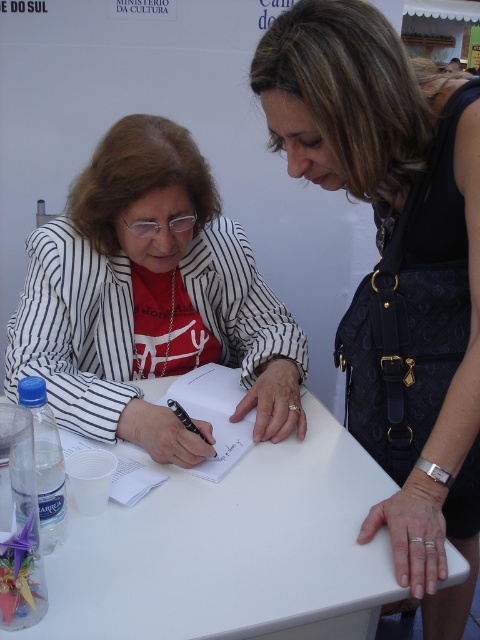
Is matte black jacket at center further to camera compared to white plastic table at center?

Yes, matte black jacket at center is behind white plastic table at center.

Does matte black jacket at center appear on the left side of white plastic table at center?

Indeed, matte black jacket at center is positioned on the left side of white plastic table at center.

Is point (112, 403) closer to camera compared to point (384, 556)?

That is False.

Locate an element on the screen. The height and width of the screenshot is (640, 480). matte black jacket at center is located at coordinates (149, 300).

Measure the distance between black leather handbag at upper right and camera.

The distance of black leather handbag at upper right from camera is 29.82 inches.

Between black leather handbag at upper right and matte black jacket at center, which one is positioned lower?

black leather handbag at upper right is below.

What do you see at coordinates (396, 268) in the screenshot?
I see `black leather handbag at upper right` at bounding box center [396, 268].

Locate an element on the screen. This screenshot has width=480, height=640. black leather handbag at upper right is located at coordinates (396, 268).

Does black leather handbag at upper right have a lesser height compared to white plastic table at center?

No.

Can you confirm if black leather handbag at upper right is positioned below white plastic table at center?

No, black leather handbag at upper right is not below white plastic table at center.

Identify the location of black leather handbag at upper right. (396, 268).

This screenshot has width=480, height=640. In order to click on black leather handbag at upper right in this screenshot , I will do `click(396, 268)`.